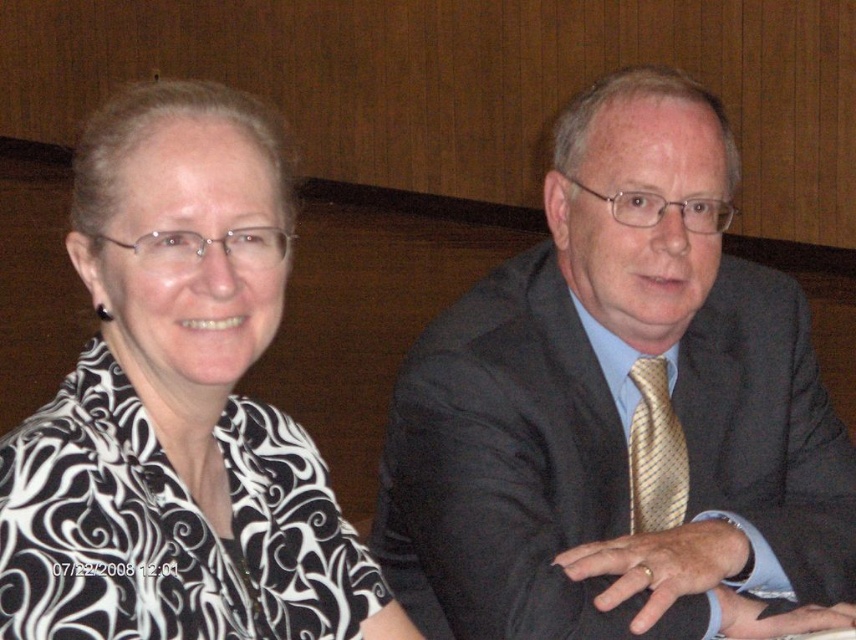
Does dark gray suit at center come behind black printed blouse at left?

Yes, it is behind black printed blouse at left.

Where is `dark gray suit at center`? The image size is (856, 640). dark gray suit at center is located at coordinates 615,406.

This screenshot has width=856, height=640. Identify the location of dark gray suit at center. (615, 406).

Identify the location of dark gray suit at center. (615, 406).

Between dark gray suit at center and gold striped tie at center, which one appears on the left side from the viewer's perspective?

Positioned to the left is dark gray suit at center.

Between point (676, 128) and point (676, 465), which one is positioned behind?

Positioned behind is point (676, 465).

Locate an element on the screen. Image resolution: width=856 pixels, height=640 pixels. dark gray suit at center is located at coordinates (615, 406).

Does black printed blouse at left have a larger size compared to gold striped tie at center?

Yes.

Measure the distance from black printed blouse at left to gold striped tie at center.

black printed blouse at left and gold striped tie at center are 22.04 inches apart.

The height and width of the screenshot is (640, 856). Identify the location of black printed blouse at left. (177, 404).